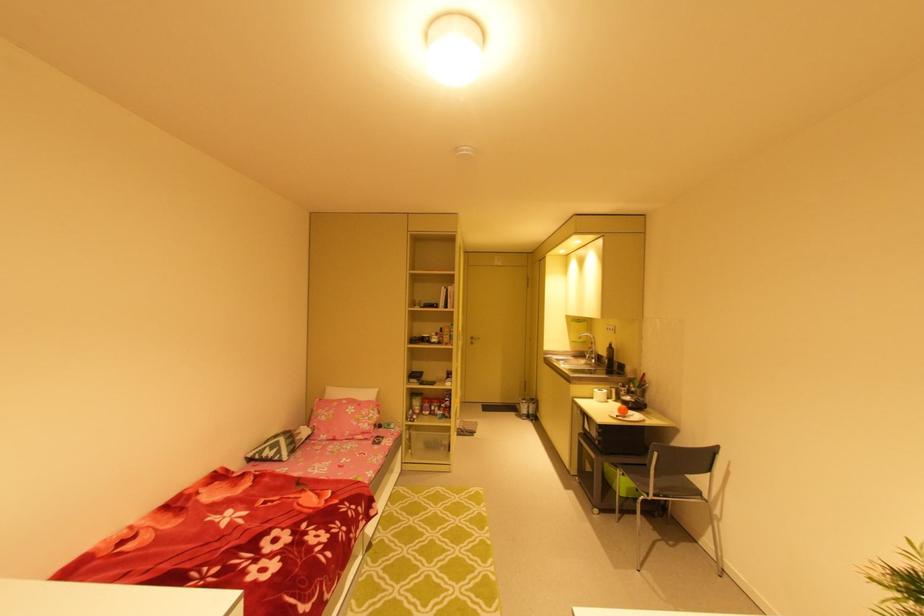
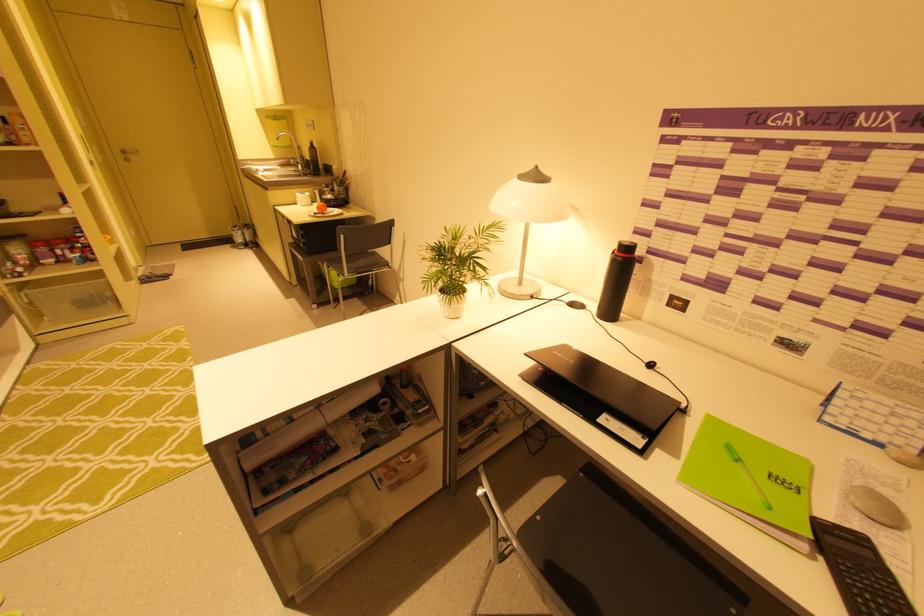
Where in the second image is the point corresponding to the point at 612,400 from the first image?

(317, 203)